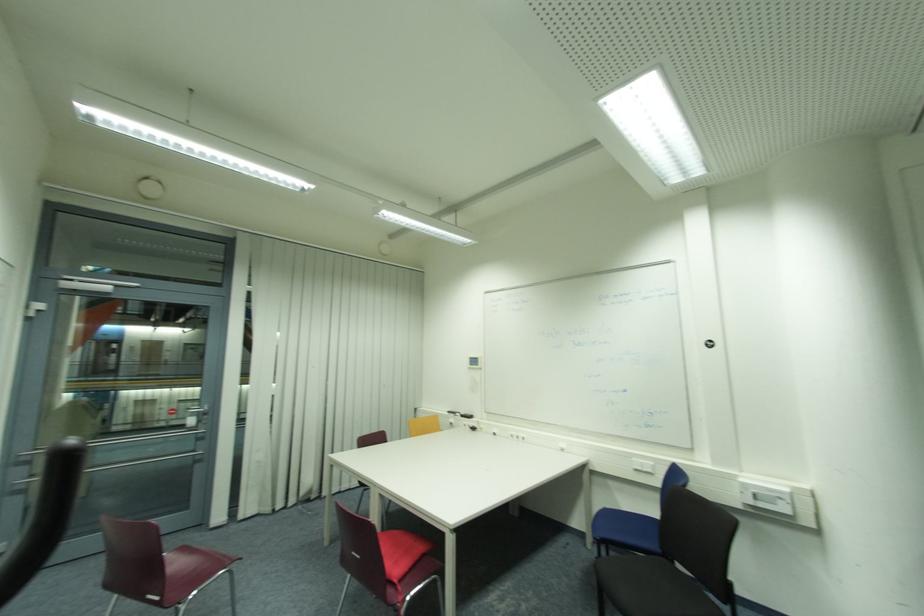
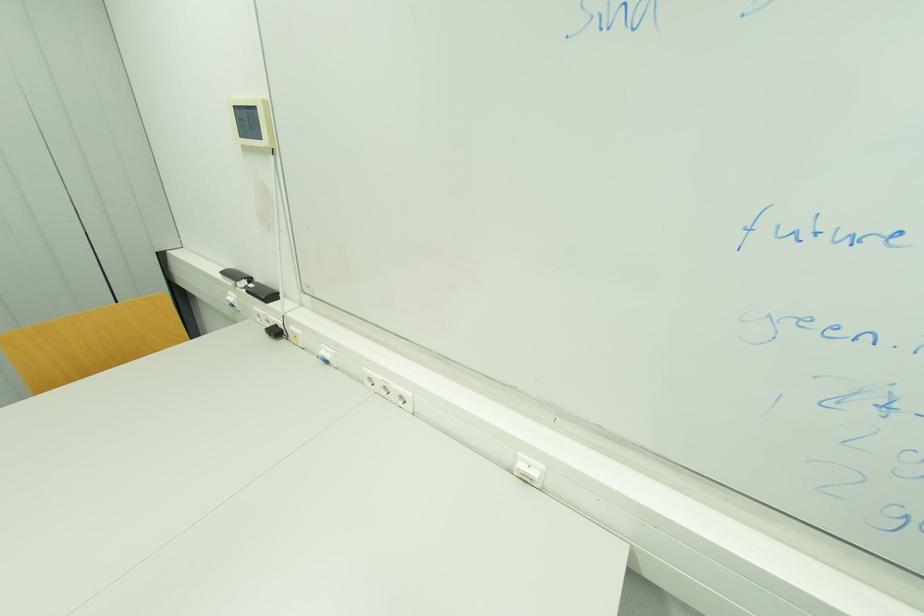
Find the pixel in the second image that matches (x=529, y=437) in the first image.

(409, 394)